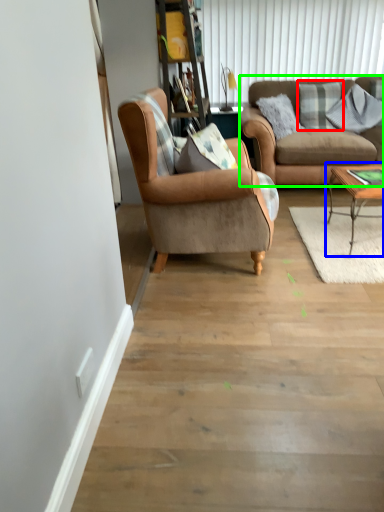
Question: Considering the real-world distances, which object is closest to pillow (highlighted by a red box)? coffee table (highlighted by a blue box) or studio couch (highlighted by a green box).

Choices:
 (A) coffee table
 (B) studio couch

Answer: (B)